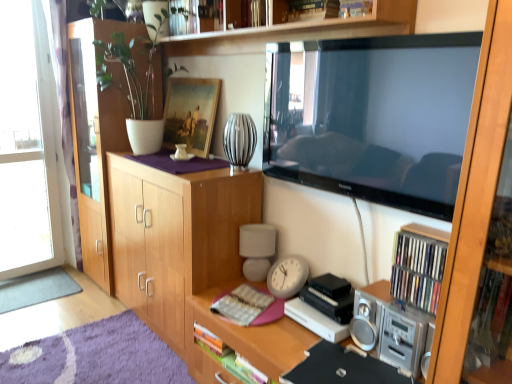
You are a GUI agent. You are given a task and a screenshot of the screen. Output one action in this format:
    pyautogui.click(x=<x>, y=<y>)
    Task: Click on the free space in front of hardcover book at center
    This screenshot has height=384, width=512.
    Given the screenshot: What is the action you would take?
    pyautogui.click(x=259, y=337)